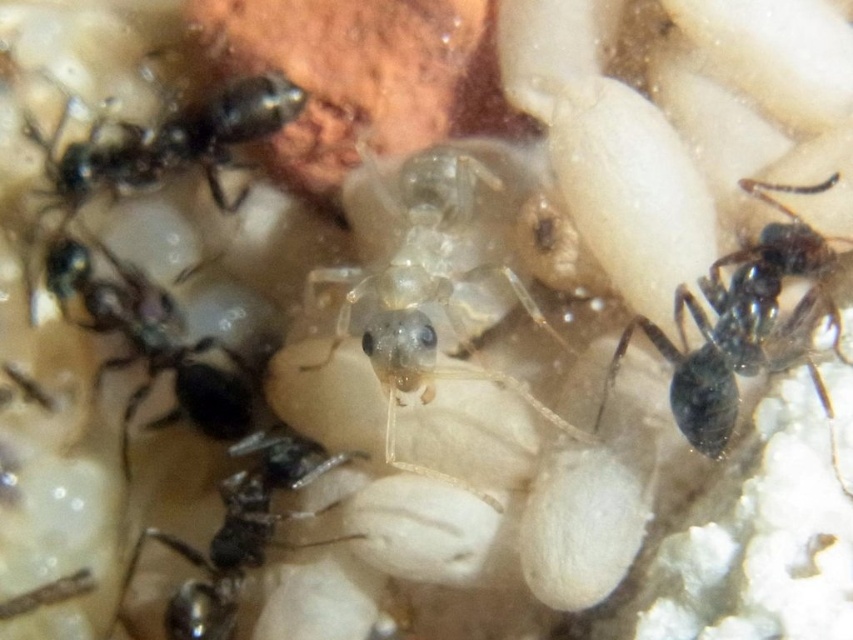
Does black glossy ant at lower left appear on the left side of shiny black ant at upper left?

Indeed, black glossy ant at lower left is positioned on the left side of shiny black ant at upper left.

Who is more forward, (50,268) or (30,129)?

Point (50,268) is in front.

Does point (74, 294) come closer to viewer compared to point (112, 170)?

Yes, point (74, 294) is in front of point (112, 170).

Where is `black glossy ant at lower left`? The height and width of the screenshot is (640, 853). black glossy ant at lower left is located at coordinates (151, 340).

Which is in front, point (456, 161) or point (656, 342)?

Positioned in front is point (656, 342).

Does translucent gelatinous ant at center have a greater width compared to black glossy ant at right?

Indeed, translucent gelatinous ant at center has a greater width compared to black glossy ant at right.

Where is `translucent gelatinous ant at center`? The image size is (853, 640). translucent gelatinous ant at center is located at coordinates pyautogui.click(x=433, y=276).

Is point (401, 241) closer to viewer compared to point (234, 509)?

No.

The width and height of the screenshot is (853, 640). Find the location of `translucent gelatinous ant at center`. translucent gelatinous ant at center is located at coordinates (433, 276).

This screenshot has height=640, width=853. I want to click on translucent gelatinous ant at center, so click(x=433, y=276).